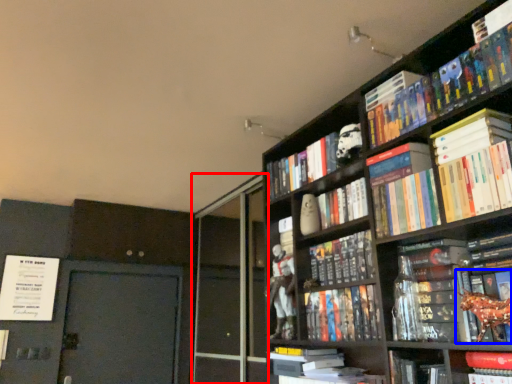
Question: Which point is closer to the camera, screen door (highlighted by a red box) or book (highlighted by a blue box)?

Choices:
 (A) screen door
 (B) book

Answer: (B)